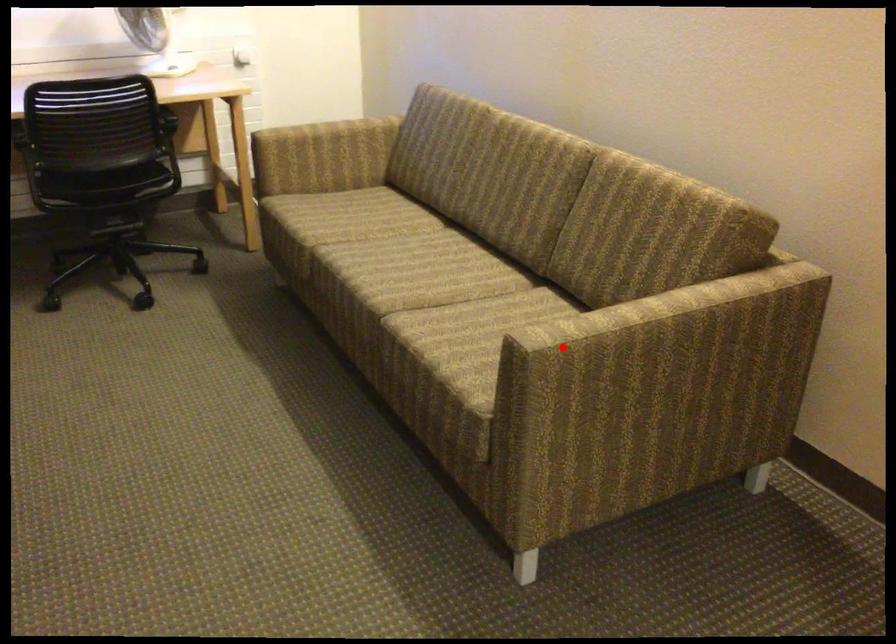
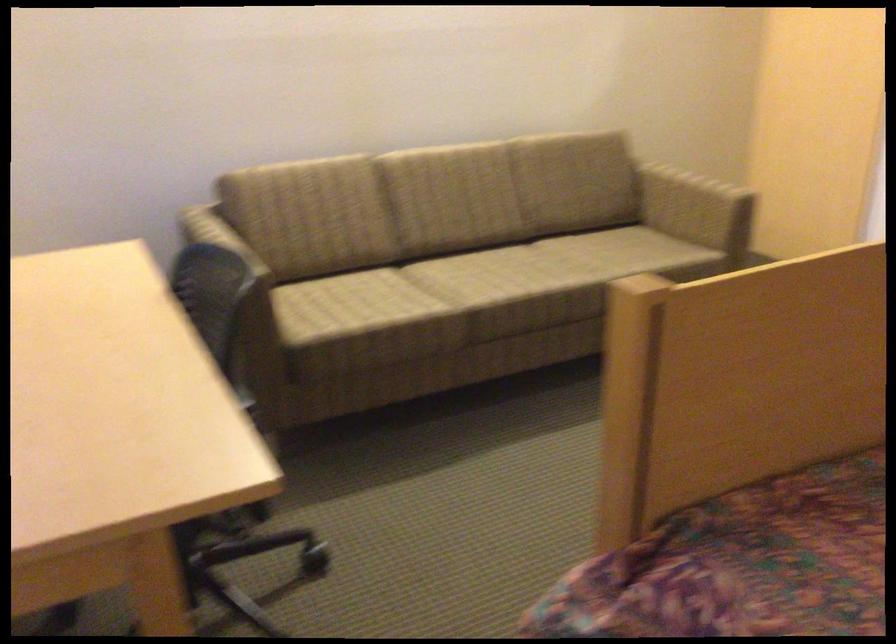
Where in the second image is the point corresponding to the highlighted location from the first image?

(694, 207)